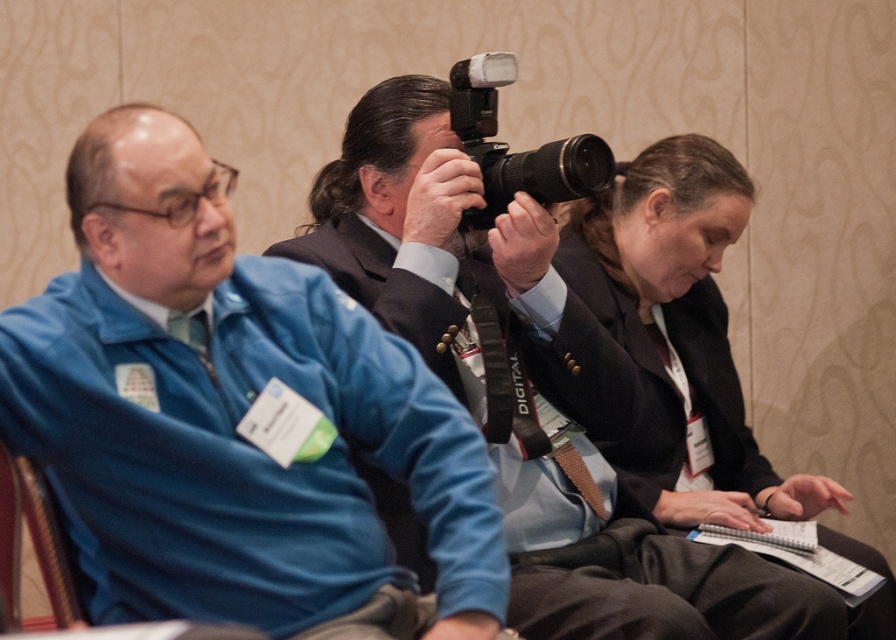
Question: From the image, what is the correct spatial relationship of black matte camera at center in relation to matte black blazer at center?

Choices:
 (A) above
 (B) below

Answer: (B)

Question: Which of the following is the closest to the observer?

Choices:
 (A) black plastic camera at center
 (B) blue fleece jacket at left
 (C) matte black blazer at center

Answer: (B)

Question: Is matte black blazer at center below black plastic camera at center?

Choices:
 (A) yes
 (B) no

Answer: (A)

Question: Considering the real-world distances, which object is farthest from the matte black blazer at center?

Choices:
 (A) black matte camera at center
 (B) blue fleece jacket at left

Answer: (B)

Question: Which object appears closest to the camera in this image?

Choices:
 (A) blue fleece jacket at left
 (B) black matte camera at center
 (C) matte black blazer at center

Answer: (A)

Question: Is blue fleece jacket at left bigger than matte black blazer at center?

Choices:
 (A) no
 (B) yes

Answer: (A)